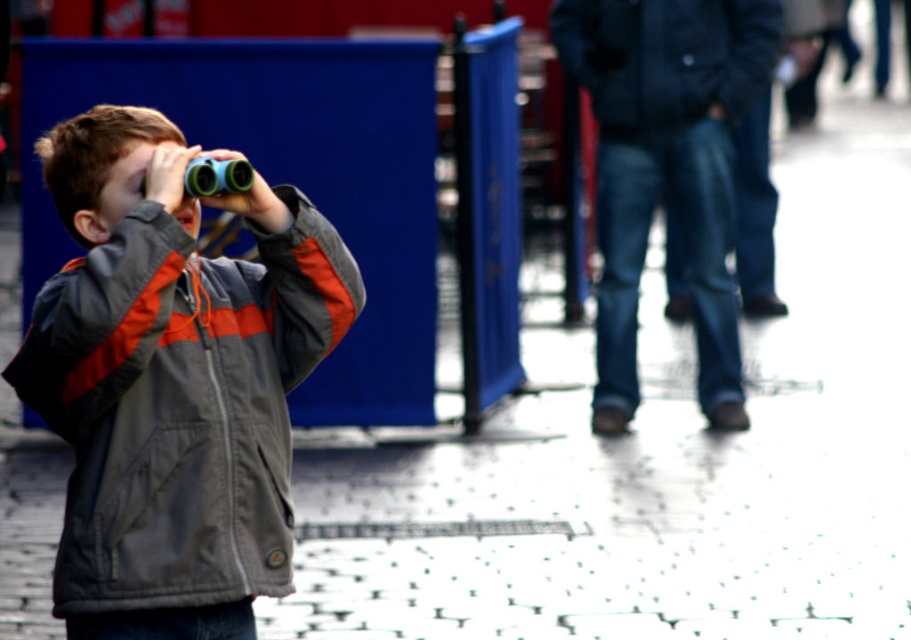
Which is more to the right, gray fabric jacket at center or dark blue jacket at upper right?

dark blue jacket at upper right

Who is taller, gray fabric jacket at center or dark blue jacket at upper right?

gray fabric jacket at center is taller.

Does point (259, 310) come closer to viewer compared to point (773, 48)?

Yes.

The width and height of the screenshot is (911, 640). In order to click on gray fabric jacket at center in this screenshot , I will do `click(173, 380)`.